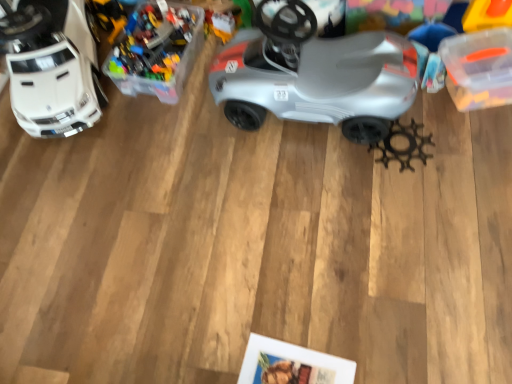
Locate an element on the screen. The width and height of the screenshot is (512, 384). free space above metallic gear at lower right, the 3th toy viewed from the left (from a real-world perspective) is located at coordinates coord(401,145).